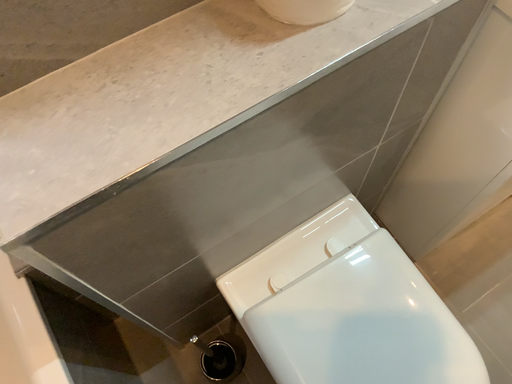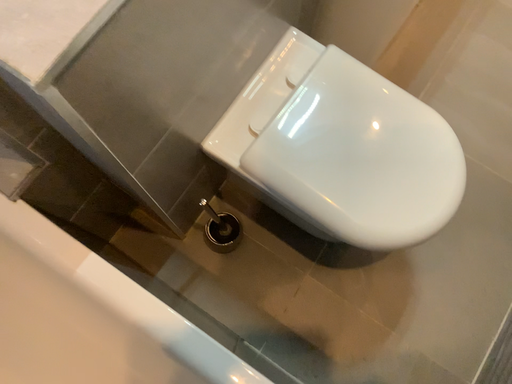
Question: Which way did the camera rotate in the video?

Choices:
 (A) rotated upward
 (B) rotated downward

Answer: (B)